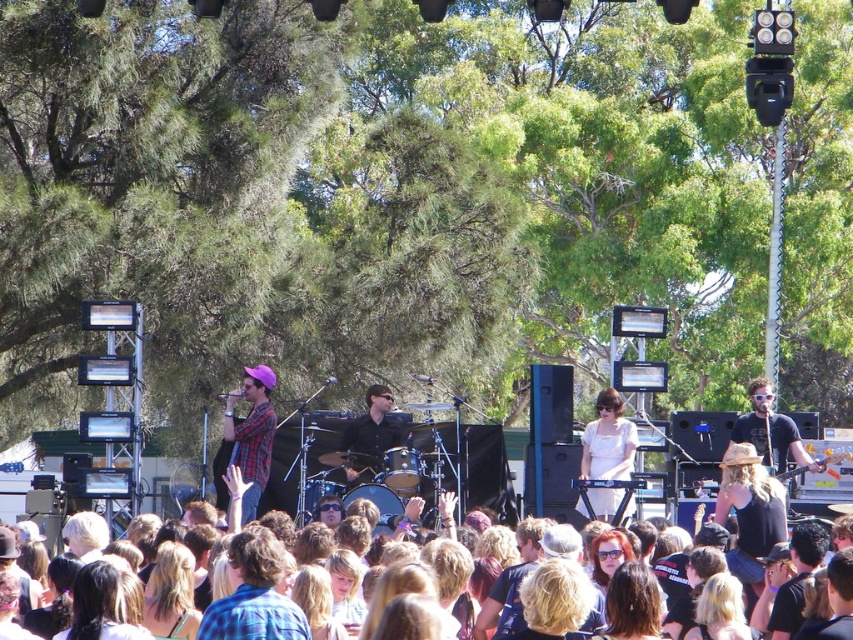
Between white matte dress at center and brown hair at center, which one is positioned lower?

brown hair at center

Is point (596, 500) positioned in front of point (228, 472)?

No, (596, 500) is further to viewer.

This screenshot has height=640, width=853. I want to click on white matte dress at center, so click(x=608, y=440).

Is black matte shirt at center to the right of brown hair at center from the viewer's perspective?

Yes, black matte shirt at center is to the right of brown hair at center.

Does point (374, 401) lie behind point (250, 528)?

Yes, point (374, 401) is farther from viewer.

What do you see at coordinates (370, 433) in the screenshot? This screenshot has width=853, height=640. I see `black matte shirt at center` at bounding box center [370, 433].

Identify the location of black matte shirt at center. (370, 433).

Which is in front, point (595, 436) or point (231, 449)?

Point (231, 449) is in front.

Does white matte dress at center come behind plaid fabric shirt at center?

No, white matte dress at center is in front of plaid fabric shirt at center.

Which is in front, point (599, 488) or point (276, 422)?

Positioned in front is point (599, 488).

The image size is (853, 640). What are the coordinates of `white matte dress at center` in the screenshot? It's located at (608, 440).